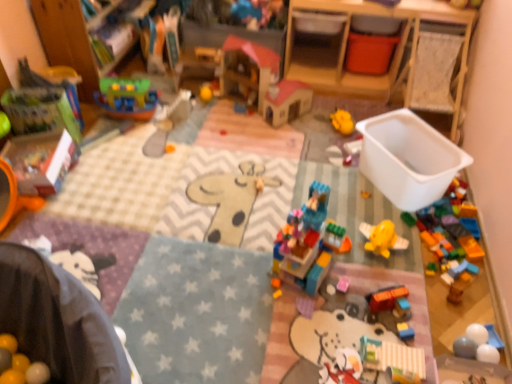
Identify the location of free point to the right of translucent plastic airplane at center, placed as the fourth toy when sorted from bottom to top. This screenshot has width=512, height=384. (391, 203).